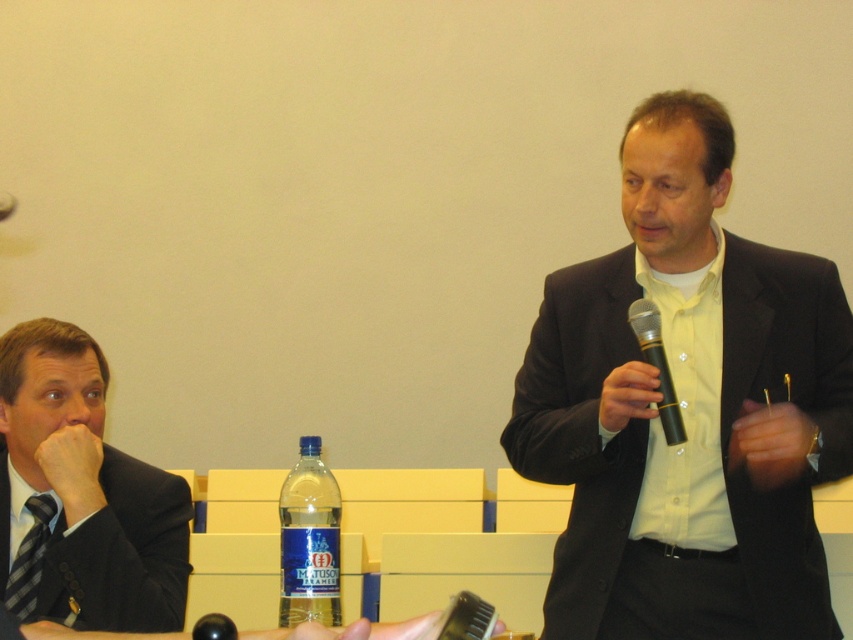
Who is more forward, (113, 552) or (640, 349)?

Positioned in front is point (113, 552).

Can you confirm if black textured suit at left is smaller than black matte microphone at center?

Incorrect, black textured suit at left is not smaller in size than black matte microphone at center.

Between point (109, 544) and point (660, 353), which one is positioned behind?

The point (660, 353) is behind.

Where is `black textured suit at left`? Image resolution: width=853 pixels, height=640 pixels. black textured suit at left is located at coordinates tap(122, 554).

Is matte black suit at right thinner than black matte microphone at center?

In fact, matte black suit at right might be wider than black matte microphone at center.

Between matte black suit at right and black matte microphone at center, which one has less height?

black matte microphone at center

Who is more distant from viewer, (833, 616) or (670, 435)?

The point (833, 616) is more distant.

Find the location of a particular element. The width and height of the screenshot is (853, 640). matte black suit at right is located at coordinates (688, 410).

Does point (759, 276) come in front of point (288, 486)?

No, (759, 276) is further to viewer.

Which is below, matte black suit at right or blue plastic bottle at center?

blue plastic bottle at center is lower down.

You are a GUI agent. You are given a task and a screenshot of the screen. Output one action in this format:
    pyautogui.click(x=<x>, y=<y>)
    Task: Click on the matte black suit at right
    The height and width of the screenshot is (640, 853).
    Given the screenshot: What is the action you would take?
    pyautogui.click(x=688, y=410)